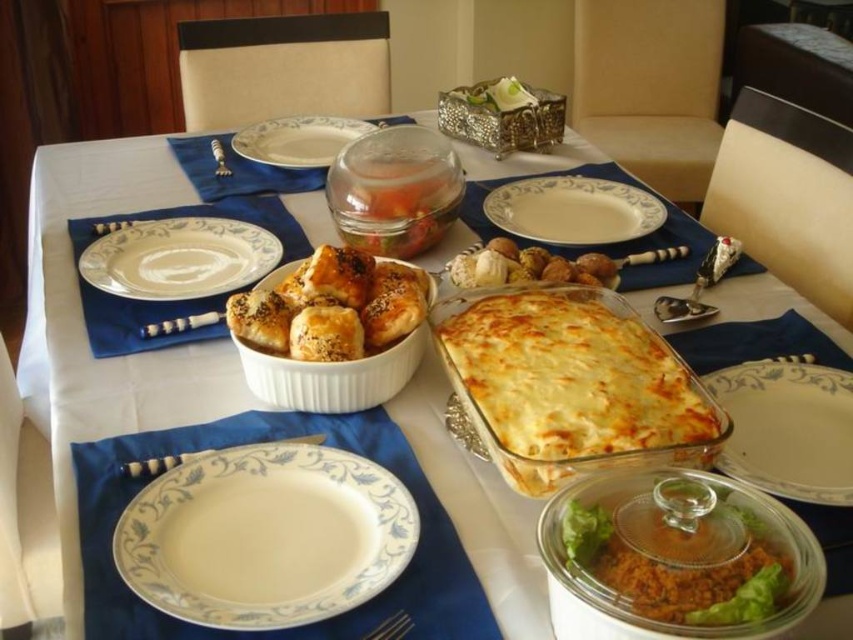
Question: Can you confirm if white glossy platter at lower left is thinner than golden brown baked dish at center?

Choices:
 (A) yes
 (B) no

Answer: (A)

Question: Does white porcelain bowl at center have a larger size compared to clear glass bowl at center?

Choices:
 (A) no
 (B) yes

Answer: (B)

Question: Which point is closer to the camera?

Choices:
 (A) (160, 316)
 (B) (587, 227)
 (C) (372, 632)
 (D) (294, 157)

Answer: (C)

Question: Which point is closer to the camera taking this photo?

Choices:
 (A) (851, 490)
 (B) (128, 237)
 (C) (410, 624)

Answer: (C)

Question: Among these points, which one is farthest from the camera?

Choices:
 (A) (268, 150)
 (B) (219, 156)
 (C) (86, 227)
 (D) (558, 481)

Answer: (A)

Question: Can you confirm if white porcelain plate at upper left is wider than brushed metal butter knife at upper center?

Choices:
 (A) no
 (B) yes

Answer: (B)